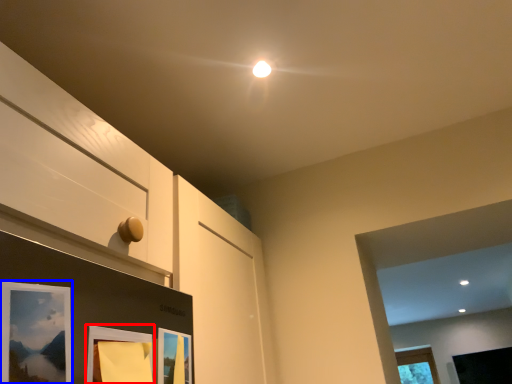
Question: Which of the following is the closest to the observer, picture frame (highlighted by a red box) or picture frame (highlighted by a blue box)?

Choices:
 (A) picture frame
 (B) picture frame

Answer: (B)